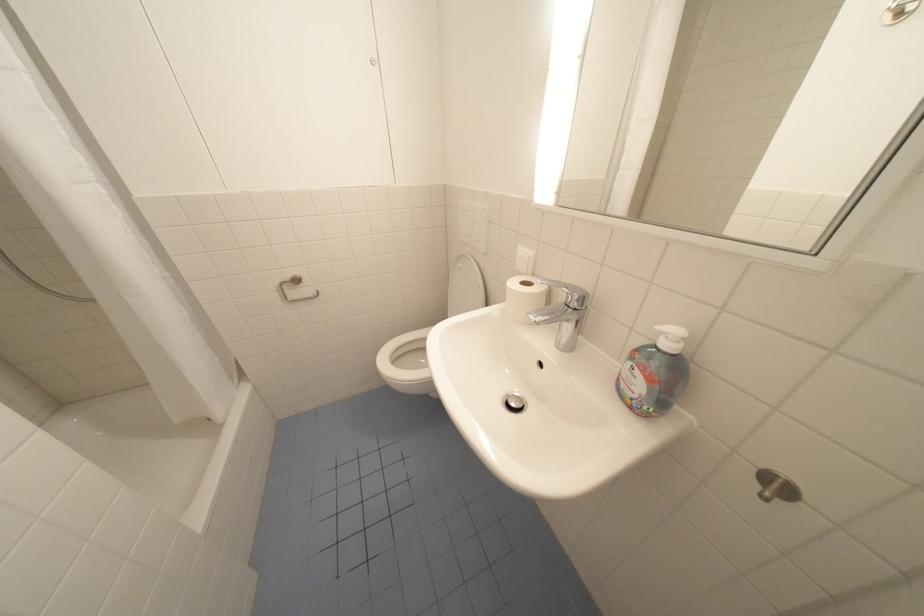
Describe the element at coordinates (465, 286) in the screenshot. I see `the white toilet lid` at that location.